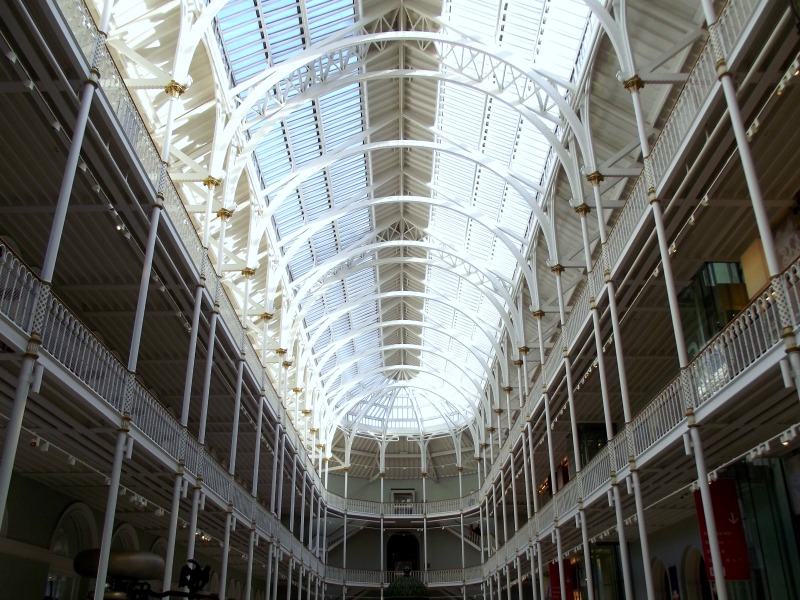
At what (x,y) coordinates should I click in order to perform the action: click on darker line of windows. Please return your answer as a coordinate pair (x, y). The height and width of the screenshot is (600, 800). Looking at the image, I should click on (326, 192).